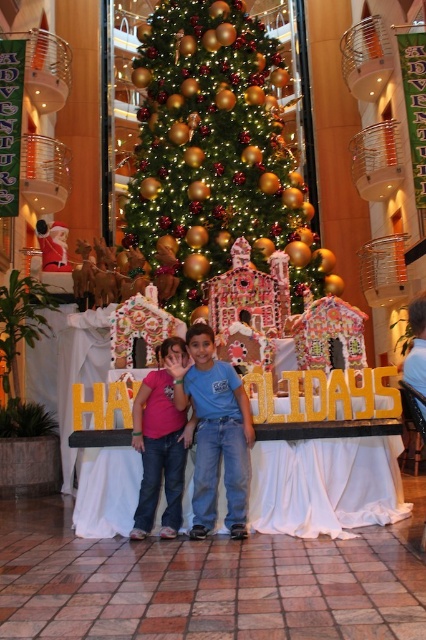
You are standing at the camera position and want to walk towards the two points marked in the scene. Which point, point (198, 227) or point (181, 481), would you reach first?

Point (181, 481) is closer to you, so you would reach it first because it is in front of point (198, 227).

You are a photographer trying to capture a clear photo of both the pink fabric dress at center and the pink fabric shirt at center. Since you want to ensure both are visible, which one should you focus on first to avoid blurring due to their size difference?

You should focus on the pink fabric dress at center first because it is larger than the pink fabric shirt at center, ensuring it remains sharp while adjusting for the smaller one.

You are a photographer setting up for a holiday photo shoot. You have two pink fabric items in the scene, a pink fabric dress at center and a pink fabric shirt at center. Which one should you focus on if you want to capture the one that is higher up?

The pink fabric dress at center is above the pink fabric shirt at center, so you should focus on the pink fabric dress at center to capture the higher one.